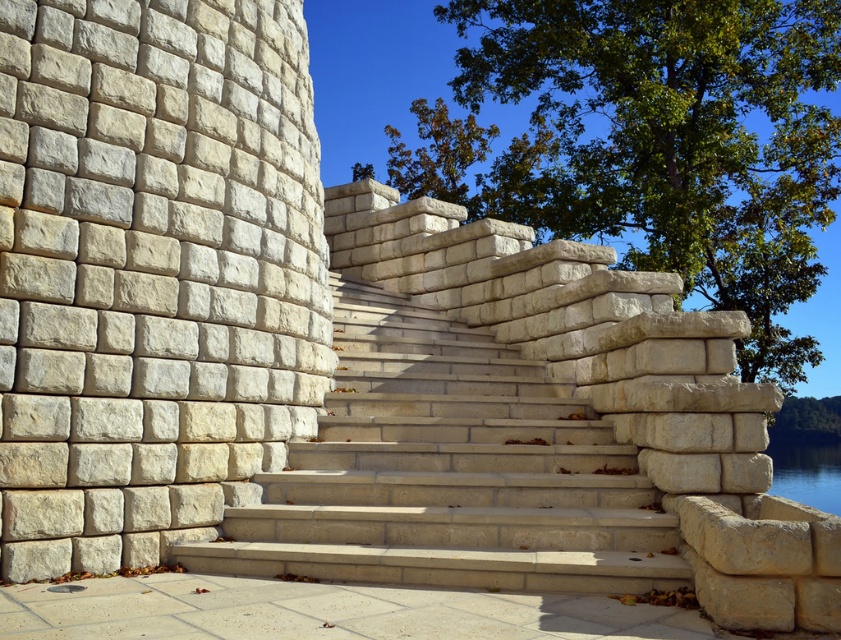
Is point (260, 554) positioned after point (540, 602)?

That is True.

Which is above, beige stone stairs at center or smooth concrete slab at lower center?

beige stone stairs at center is above.

This screenshot has height=640, width=841. Describe the element at coordinates (448, 472) in the screenshot. I see `beige stone stairs at center` at that location.

You are a GUI agent. You are given a task and a screenshot of the screen. Output one action in this format:
    pyautogui.click(x=<x>, y=<y>)
    Task: Click on the beige stone stairs at center
    
    Given the screenshot: What is the action you would take?
    pyautogui.click(x=448, y=472)

Is green leafy tree at upper center positioned in front of beige stone stairs at center?

No.

Measure the distance between green leafy tree at upper center and camera.

A distance of 39.26 feet exists between green leafy tree at upper center and camera.

Is point (722, 273) positioned before point (461, 390)?

No, (722, 273) is further to viewer.

Find the location of a particular element. This screenshot has width=841, height=640. green leafy tree at upper center is located at coordinates coord(654,144).

Is point (572, 588) positioned after point (818, 419)?

No, it is in front of (818, 419).

Between beige stone stairs at center and green leafy tree at lower right, which one has less height?

With less height is beige stone stairs at center.

The width and height of the screenshot is (841, 640). Find the location of `beige stone stairs at center`. beige stone stairs at center is located at coordinates (448, 472).